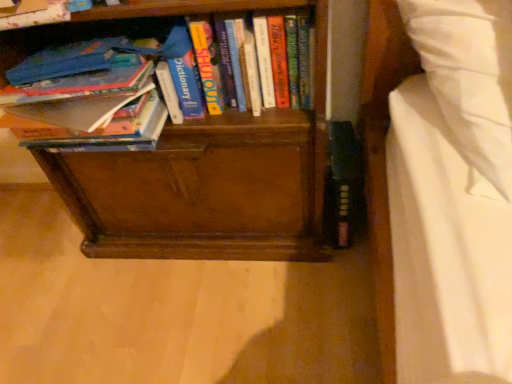
Identify the location of brown wood bookcase at center. (199, 166).

Find the location of a particular element. The image size is (512, 384). hardcover book at upper left, the 1th book from the left is located at coordinates point(35,14).

Where is `hardcover book at center, arranged as the 1th book when viewed from the right`? The height and width of the screenshot is (384, 512). hardcover book at center, arranged as the 1th book when viewed from the right is located at coordinates (208, 65).

Identify the location of brown wood bookcase at center. (199, 166).

From a real-world perspective, between hardcover book at left, which ranks as the 2th book in left-to-right order, and hardcover book at upper left, which ranks as the 3th book in right-to-left order, who is vertically lower?

hardcover book at left, which ranks as the 2th book in left-to-right order.

Which is in front, hardcover book at left, which ranks as the 2th book in left-to-right order, or hardcover book at upper left, which ranks as the 3th book in right-to-left order?

hardcover book at upper left, which ranks as the 3th book in right-to-left order, is more forward.

This screenshot has height=384, width=512. There is a hardcover book at left, which appears as the 2th book when viewed from the right. Identify the location of the 2nd book above it (from the image's perspective). (35, 14).

Does hardcover book at left, which ranks as the 2th book in left-to-right order, have a greater height compared to hardcover book at upper left, which ranks as the 3th book in right-to-left order?

Yes.

How many degrees apart are the facing directions of hardcover book at left, which appears as the 2th book when viewed from the right, and brown wood bookcase at center?

hardcover book at left, which appears as the 2th book when viewed from the right, and brown wood bookcase at center are facing 2.27 degrees away from each other.

From the picture: Which of these two, hardcover book at left, which appears as the 2th book when viewed from the right, or brown wood bookcase at center, stands shorter?

hardcover book at left, which appears as the 2th book when viewed from the right, is shorter.

Is hardcover book at left, which ranks as the 2th book in left-to-right order, smaller than brown wood bookcase at center?

Yes, hardcover book at left, which ranks as the 2th book in left-to-right order, is smaller than brown wood bookcase at center.

From the image's perspective, is hardcover book at left, which appears as the 2th book when viewed from the right, located above or below brown wood bookcase at center?

hardcover book at left, which appears as the 2th book when viewed from the right, is situated higher than brown wood bookcase at center in the image.

Can you confirm if hardcover book at center, placed as the third book when sorted from left to right, is wider than hardcover book at left, which ranks as the 2th book in left-to-right order?

No, hardcover book at center, placed as the third book when sorted from left to right, is not wider than hardcover book at left, which ranks as the 2th book in left-to-right order.

From a real-world perspective, is hardcover book at center, arranged as the 1th book when viewed from the right, above or below hardcover book at left, which ranks as the 2th book in left-to-right order?

Clearly, from a real-world perspective, hardcover book at center, arranged as the 1th book when viewed from the right, is above hardcover book at left, which ranks as the 2th book in left-to-right order.

Is hardcover book at center, arranged as the 1th book when viewed from the right, at the right side of hardcover book at left, which ranks as the 2th book in left-to-right order?

Indeed, hardcover book at center, arranged as the 1th book when viewed from the right, is positioned on the right side of hardcover book at left, which ranks as the 2th book in left-to-right order.

Considering the sizes of objects hardcover book at center, arranged as the 1th book when viewed from the right, and hardcover book at left, which appears as the 2th book when viewed from the right, in the image provided, who is smaller, hardcover book at center, arranged as the 1th book when viewed from the right, or hardcover book at left, which appears as the 2th book when viewed from the right,?

Smaller between the two is hardcover book at center, arranged as the 1th book when viewed from the right.

Considering the positions of objects hardcover book at center, placed as the third book when sorted from left to right, and brown wood bookcase at center in the image provided, who is more to the right, hardcover book at center, placed as the third book when sorted from left to right, or brown wood bookcase at center?

Positioned to the right is hardcover book at center, placed as the third book when sorted from left to right.

In the scene shown: Does hardcover book at center, placed as the third book when sorted from left to right, have a greater width compared to brown wood bookcase at center?

Incorrect, the width of hardcover book at center, placed as the third book when sorted from left to right, does not surpass that of brown wood bookcase at center.

Is hardcover book at center, arranged as the 1th book when viewed from the right, turned away from brown wood bookcase at center?

Yes.

Which of these two, hardcover book at center, placed as the third book when sorted from left to right, or brown wood bookcase at center, is bigger?

With larger size is brown wood bookcase at center.

In the scene shown: Can you confirm if brown wood bookcase at center is wider than hardcover book at upper left, the 1th book from the left?

Correct, the width of brown wood bookcase at center exceeds that of hardcover book at upper left, the 1th book from the left.

Which point is more forward, [220,255] or [36,25]?

The point [36,25] is in front.

From a real-world perspective, is brown wood bookcase at center under hardcover book at upper left, which ranks as the 3th book in right-to-left order?

Yes, from a real-world perspective, brown wood bookcase at center is beneath hardcover book at upper left, which ranks as the 3th book in right-to-left order.

I want to click on bookcase below the hardcover book at upper left, which ranks as the 3th book in right-to-left order (from the image's perspective), so click(199, 166).

From the image's perspective, is hardcover book at upper left, the 1th book from the left, above hardcover book at center, arranged as the 1th book when viewed from the right?

Yes.

Which of these two, hardcover book at upper left, which ranks as the 3th book in right-to-left order, or hardcover book at center, arranged as the 1th book when viewed from the right, is bigger?

Bigger between the two is hardcover book at center, arranged as the 1th book when viewed from the right.

Considering the relative positions of hardcover book at upper left, which ranks as the 3th book in right-to-left order, and hardcover book at center, arranged as the 1th book when viewed from the right, in the image provided, is hardcover book at upper left, which ranks as the 3th book in right-to-left order, to the right of hardcover book at center, arranged as the 1th book when viewed from the right, from the viewer's perspective?

No, hardcover book at upper left, which ranks as the 3th book in right-to-left order, is not to the right of hardcover book at center, arranged as the 1th book when viewed from the right.

Which point is more forward, (32, 19) or (301, 14)?

The point (32, 19) is closer to the camera.

Would you say brown wood bookcase at center is outside hardcover book at left, which appears as the 2th book when viewed from the right?

brown wood bookcase at center is positioned outside hardcover book at left, which appears as the 2th book when viewed from the right.

Is there a large distance between brown wood bookcase at center and hardcover book at left, which appears as the 2th book when viewed from the right?

No, brown wood bookcase at center is not far away from hardcover book at left, which appears as the 2th book when viewed from the right.

From the image's perspective, is brown wood bookcase at center on hardcover book at left, which appears as the 2th book when viewed from the right?

No, from the image's perspective, brown wood bookcase at center is not over hardcover book at left, which appears as the 2th book when viewed from the right.

Can you confirm if brown wood bookcase at center is shorter than hardcover book at left, which appears as the 2th book when viewed from the right?

No, brown wood bookcase at center is not shorter than hardcover book at left, which appears as the 2th book when viewed from the right.

Where is `book in front of the hardcover book at left, which ranks as the 2th book in left-to-right order`? This screenshot has height=384, width=512. book in front of the hardcover book at left, which ranks as the 2th book in left-to-right order is located at coordinates (35, 14).

Where is `the 1st book behind the brown wood bookcase at center`? The image size is (512, 384). the 1st book behind the brown wood bookcase at center is located at coordinates (90, 111).

Looking at the image, which one is located closer to brown wood bookcase at center, hardcover book at upper left, which ranks as the 3th book in right-to-left order, or hardcover book at center, placed as the third book when sorted from left to right?

hardcover book at center, placed as the third book when sorted from left to right, is positioned closer to the anchor brown wood bookcase at center.

Based on their spatial positions, is hardcover book at left, which ranks as the 2th book in left-to-right order, or hardcover book at upper left, the 1th book from the left, closer to brown wood bookcase at center?

The object closer to brown wood bookcase at center is hardcover book at left, which ranks as the 2th book in left-to-right order.

Estimate the real-world distances between objects in this image. Which object is closer to hardcover book at upper left, which ranks as the 3th book in right-to-left order, brown wood bookcase at center or hardcover book at center, placed as the third book when sorted from left to right?

Among the two, hardcover book at center, placed as the third book when sorted from left to right, is located nearer to hardcover book at upper left, which ranks as the 3th book in right-to-left order.

Looking at the image, which one is located further to hardcover book at center, arranged as the 1th book when viewed from the right, hardcover book at left, which ranks as the 2th book in left-to-right order, or brown wood bookcase at center?

brown wood bookcase at center is further to hardcover book at center, arranged as the 1th book when viewed from the right.

Looking at this image, looking at the image, which one is located further to hardcover book at left, which appears as the 2th book when viewed from the right, hardcover book at center, arranged as the 1th book when viewed from the right, or brown wood bookcase at center?

hardcover book at center, arranged as the 1th book when viewed from the right, lies further to hardcover book at left, which appears as the 2th book when viewed from the right, than the other object.

Considering their positions, is hardcover book at upper left, the 1th book from the left, positioned further to hardcover book at left, which appears as the 2th book when viewed from the right, than hardcover book at center, placed as the third book when sorted from left to right?

The object further to hardcover book at left, which appears as the 2th book when viewed from the right, is hardcover book at center, placed as the third book when sorted from left to right.

Based on their spatial positions, is hardcover book at left, which appears as the 2th book when viewed from the right, or hardcover book at center, arranged as the 1th book when viewed from the right, further from brown wood bookcase at center?

hardcover book at center, arranged as the 1th book when viewed from the right, is positioned further to the anchor brown wood bookcase at center.

Based on their spatial positions, is brown wood bookcase at center or hardcover book at upper left, the 1th book from the left, closer to hardcover book at center, placed as the third book when sorted from left to right?

Among the two, brown wood bookcase at center is located nearer to hardcover book at center, placed as the third book when sorted from left to right.

Locate an element on the screen. This screenshot has height=384, width=512. bookcase situated between hardcover book at upper left, the 1th book from the left, and hardcover book at center, placed as the third book when sorted from left to right, from left to right is located at coordinates (199, 166).

In order to click on book located between hardcover book at upper left, the 1th book from the left, and hardcover book at center, placed as the third book when sorted from left to right, in the left-right direction in this screenshot , I will do `click(90, 111)`.

Find the location of a particular element. This screenshot has height=384, width=512. bookcase located between hardcover book at left, which appears as the 2th book when viewed from the right, and hardcover book at center, arranged as the 1th book when viewed from the right, in the left-right direction is located at coordinates click(x=199, y=166).